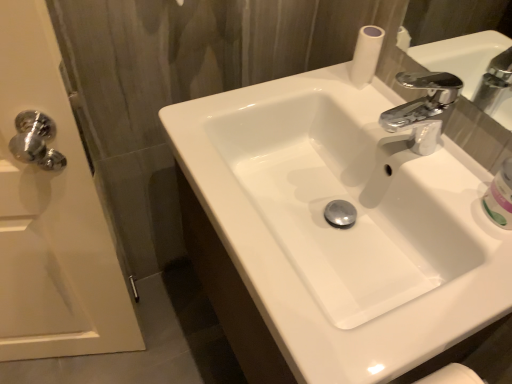
Question: From the image's perspective, is white glossy sink at center located above or below white glossy mouthwash at right?

Choices:
 (A) above
 (B) below

Answer: (B)

Question: In terms of size, does white glossy sink at center appear bigger or smaller than white glossy mouthwash at right?

Choices:
 (A) small
 (B) big

Answer: (B)

Question: Considering the real-world distances, which object is closest to the white glossy door handle at left?

Choices:
 (A) white glossy sink at center
 (B) white glossy mouthwash at right

Answer: (A)

Question: Considering the real-world distances, which object is farthest from the white glossy mouthwash at right?

Choices:
 (A) white glossy sink at center
 (B) white glossy door handle at left

Answer: (B)